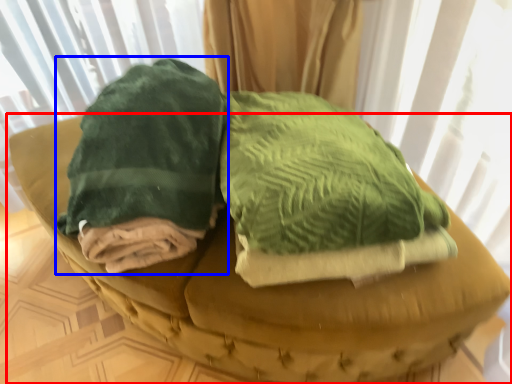
Question: Which of the following is the closest to the observer, furniture (highlighted by a red box) or cloth (highlighted by a blue box)?

Choices:
 (A) furniture
 (B) cloth

Answer: (A)